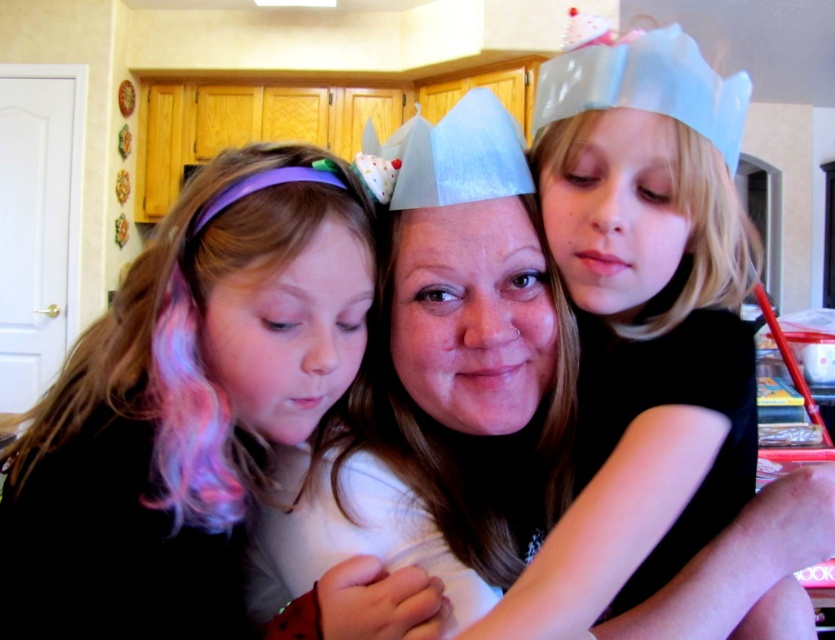
Question: Is matte purple headband at left below matte white crown at center?

Choices:
 (A) yes
 (B) no

Answer: (A)

Question: Among these objects, which one is farthest from the camera?

Choices:
 (A) matte purple headband at left
 (B) matte white crown at center

Answer: (B)

Question: Is matte purple headband at left below matte white crown at center?

Choices:
 (A) yes
 (B) no

Answer: (A)

Question: Does matte purple headband at left appear on the left side of matte white crown at center?

Choices:
 (A) yes
 (B) no

Answer: (A)

Question: Which point is farther from the camera taking this photo?

Choices:
 (A) (100, 637)
 (B) (520, 259)

Answer: (B)